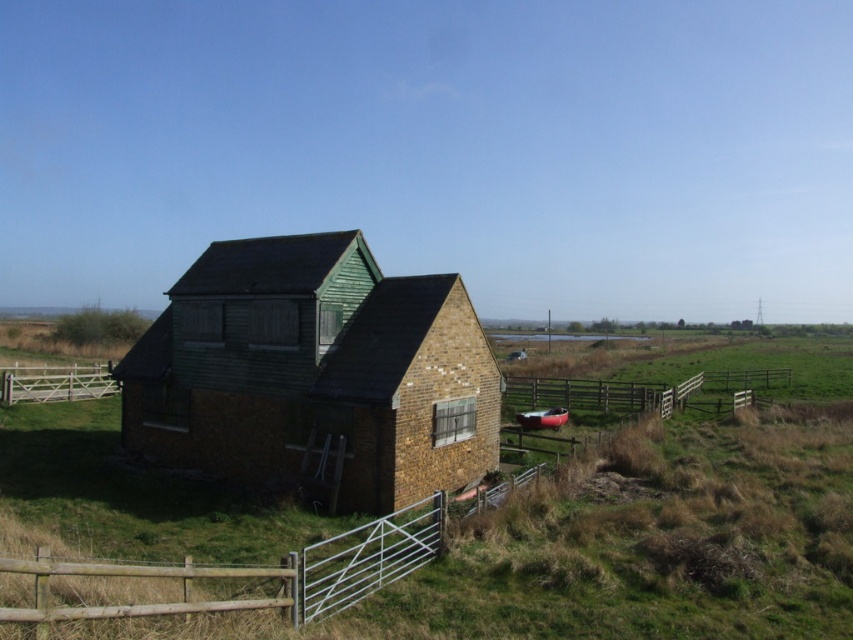
You are standing in front of the green wooden hut at center and want to walk towards the wooden at lower left. Which direction should you face?

The green wooden hut at center is to the left of wooden at lower left, so you should face to the right to walk towards the wooden at lower left.

You are standing in front of the rustic building and want to determine the relative positions of two points marked in the scene. Which point, point 1 at coordinates point (194,576) or point 2 at coordinates point (86,378), is closer to you?

Point 1 at coordinates point (194,576) is closer to the viewer than point 2 at coordinates point (86,378).

You are a visitor approaching the green wooden hut at center and the wooden at lower left. Which object will you see first as you walk towards the building?

The green wooden hut at center will be seen first because the wooden at lower left is positioned behind it.